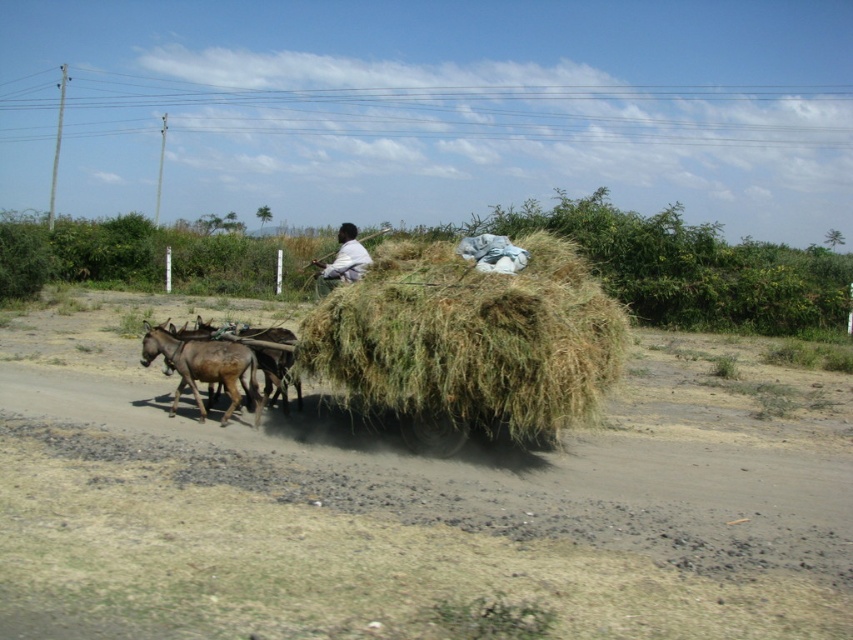
You are standing on the side of the path and want to know if the brown rough mule at left is positioned lower than the white cotton shirt at center. Can you tell me based on the scene?

The brown rough mule at left is below the white cotton shirt at center, so yes, the brown rough mule at left is positioned lower than the white cotton shirt at center.